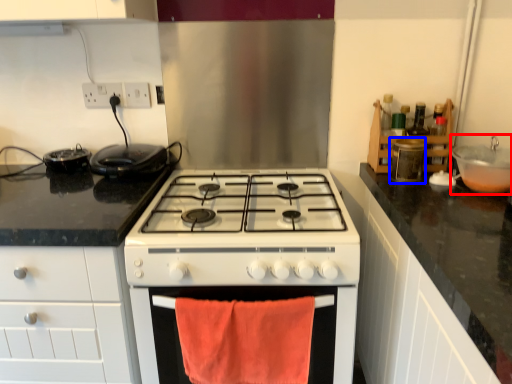
Question: Which of the following is the closest to the observer, sink (highlighted by a red box) or appliance (highlighted by a blue box)?

Choices:
 (A) sink
 (B) appliance

Answer: (A)